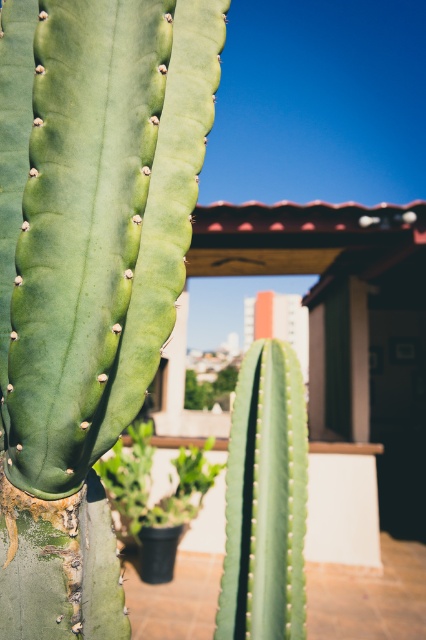
You are standing in a garden and see two cacti, the green rough cactus at center and the green matte cactus at center. Which one is positioned higher up in the image?

The green rough cactus at center is positioned higher up in the image than the green matte cactus at center.

You are a photographer standing at a certain distance from the green rough cactus at center. You want to capture a detailed closeup shot of the cactus without any distortion. The recommended safe distance for such shots is between 24 to 36 inches. Is your current position suitable?

The distance between you and the green rough cactus at center is 33.74 inches, which falls within the recommended safe range of 24 to 36 inches. Therefore, your current position is suitable for capturing a detailed closeup without distortion.

You are a gardener assessing two cacti in a garden. You see the green rough cactus at center and the green matte cactus at center. Which one is taller?

The green rough cactus at center is taller than the green matte cactus at center.